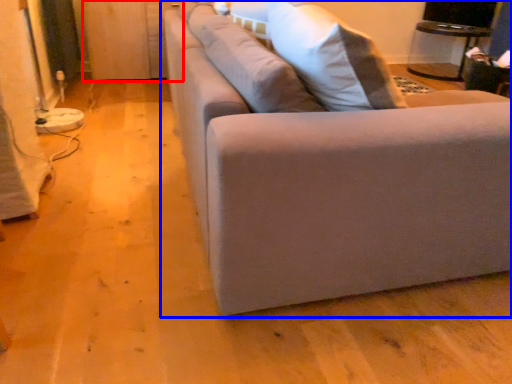
Question: Which object appears farthest to the camera in this image, dresser (highlighted by a red box) or studio couch (highlighted by a blue box)?

Choices:
 (A) dresser
 (B) studio couch

Answer: (A)